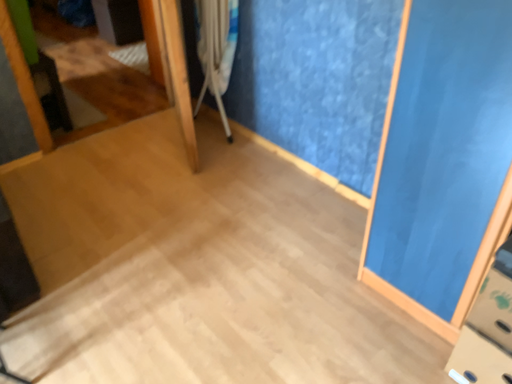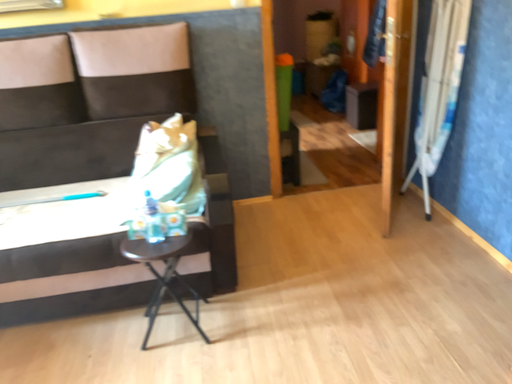
Question: How did the camera likely rotate when shooting the video?

Choices:
 (A) rotated left
 (B) rotated right

Answer: (A)